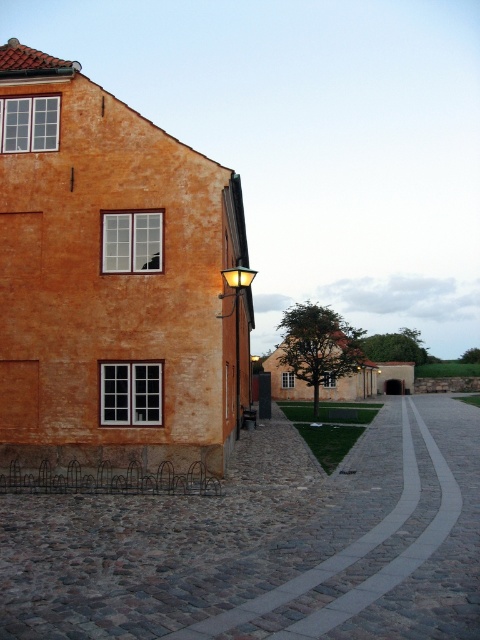
Between point (316, 618) and point (231, 314), which one is positioned behind?

Point (231, 314)

What do you see at coordinates (384, 541) in the screenshot?
I see `cobblestone path at lower center` at bounding box center [384, 541].

Is point (476, 484) in front of point (238, 275)?

That is True.

Locate an element on the screen. The height and width of the screenshot is (640, 480). cobblestone path at lower center is located at coordinates (384, 541).